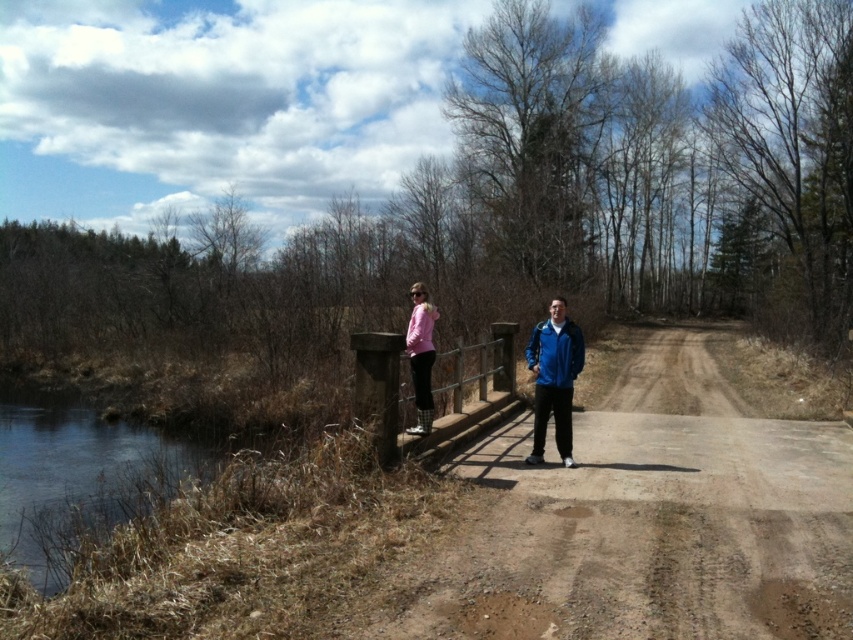
You are standing on the wooden bridge at center and want to wave to the person wearing the pink matte jacket at center. Which direction should you move to get closer to them?

The wooden bridge at center is further to the viewer than the pink matte jacket at center, so you should move forward on the wooden bridge at center towards the pink matte jacket at center to get closer.